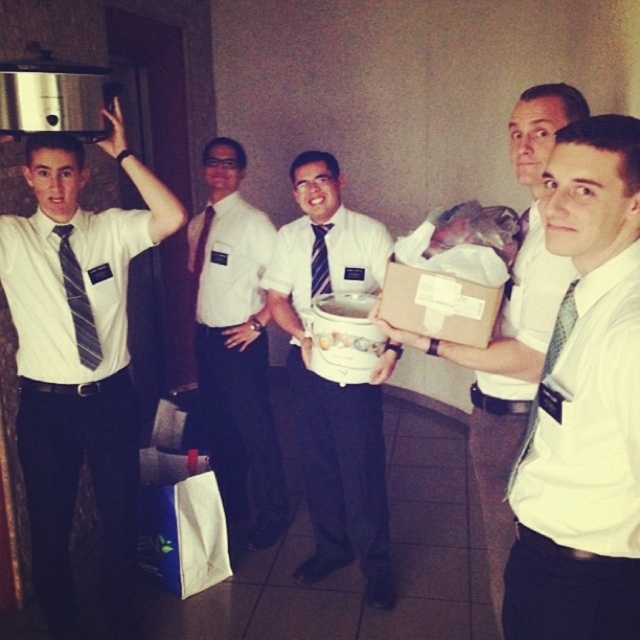
Which is more to the left, matte white bucket at center or matte white box at center?

matte white bucket at center

Does matte white bucket at center appear on the left side of matte white box at center?

Correct, you'll find matte white bucket at center to the left of matte white box at center.

Who is more forward, (320, 536) or (496, 486)?

Point (496, 486) is in front.

Identify the location of matte white bucket at center. The image size is (640, 640). (336, 381).

Who is shorter, striped fabric tie at left or green textured tie at right?

green textured tie at right

Can you confirm if striped fabric tie at left is shorter than green textured tie at right?

No, striped fabric tie at left is not shorter than green textured tie at right.

Where is `striped fabric tie at left`? This screenshot has height=640, width=640. striped fabric tie at left is located at coordinates (77, 301).

Who is more distant from viewer, (525, 438) or (321, 260)?

The point (321, 260) is more distant.

Locate an element on the screen. This screenshot has height=640, width=640. green textured tie at right is located at coordinates (561, 330).

Identify the location of green textured tie at right. The height and width of the screenshot is (640, 640). (561, 330).